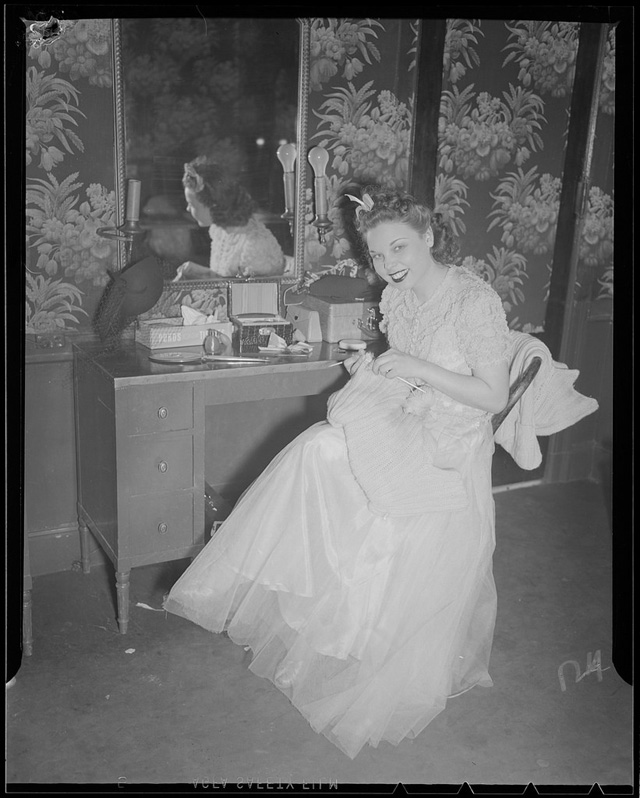
Image resolution: width=640 pixels, height=798 pixels. I want to click on hand mirror, so click(180, 358).